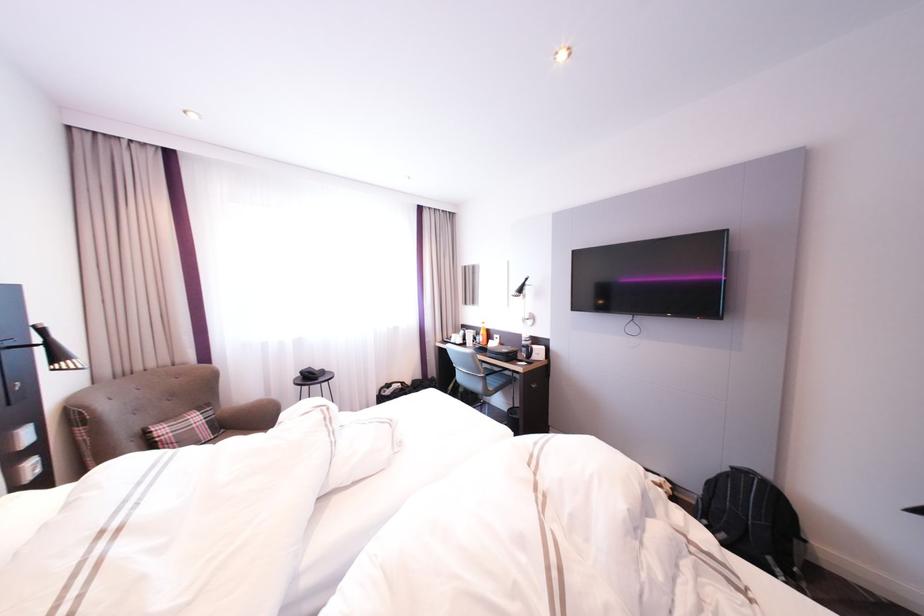
Identify the location of black backpack. (754, 523).